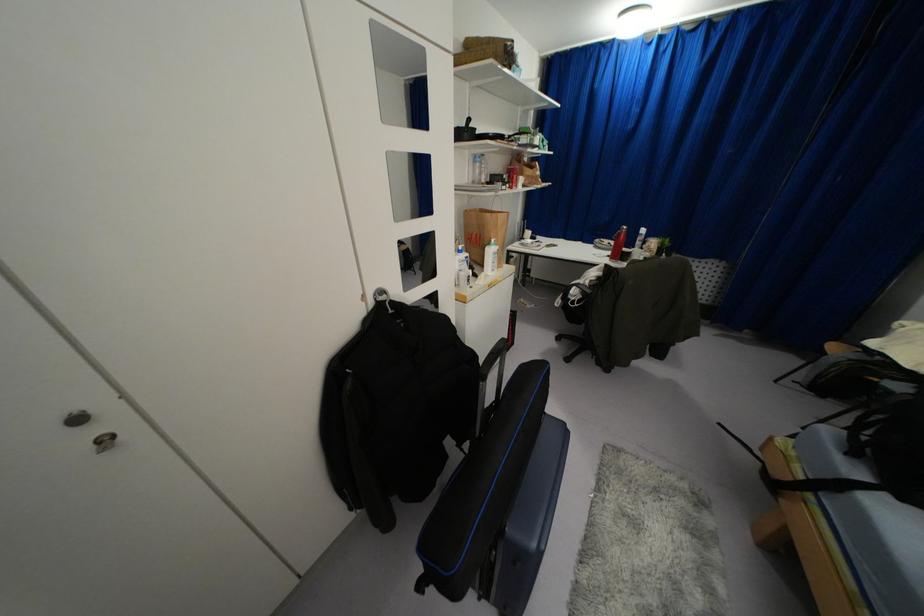
Image resolution: width=924 pixels, height=616 pixels. Describe the element at coordinates (617, 244) in the screenshot. I see `the red water bottle` at that location.